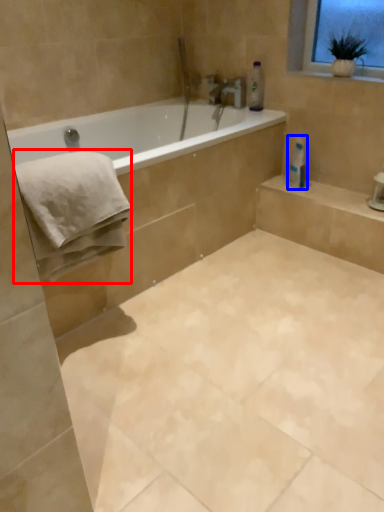
Question: Which point is further to the camera, bath towel (highlighted by a red box) or toilet paper (highlighted by a blue box)?

Choices:
 (A) bath towel
 (B) toilet paper

Answer: (B)